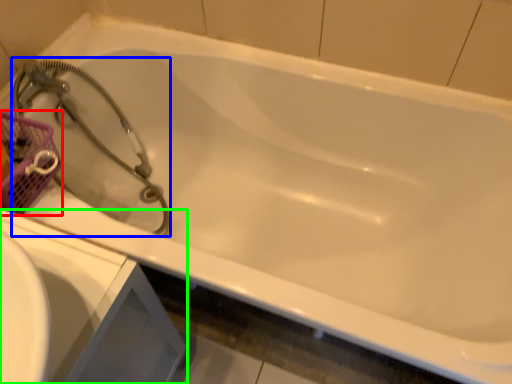
Question: Which object is the farthest from basket (highlighted by a red box)? Choose among these: garden hose (highlighted by a blue box) or sink (highlighted by a green box).

Choices:
 (A) garden hose
 (B) sink

Answer: (B)